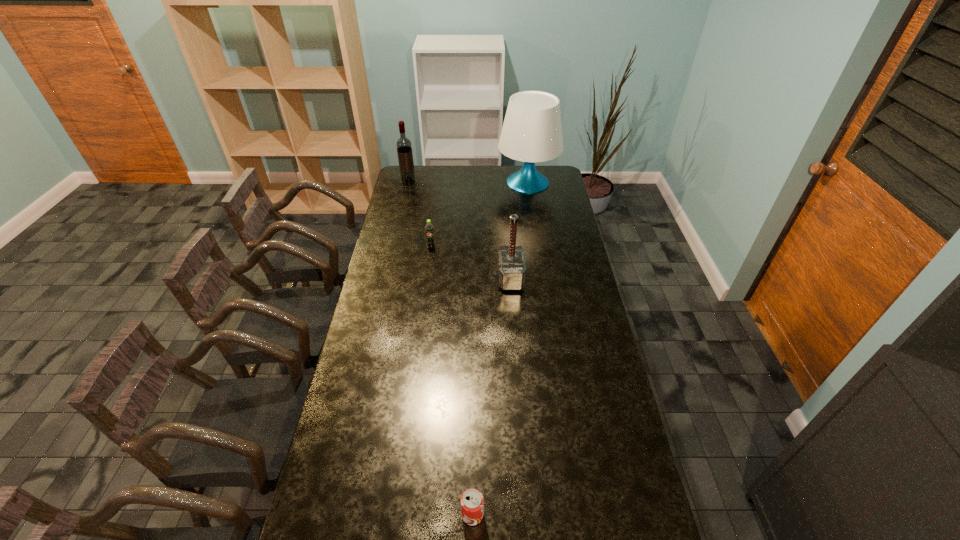
Locate an element on the screen. The image size is (960, 540). free space at the left edge is located at coordinates (361, 371).

Locate an element on the screen. vacant space at the right edge of the desktop is located at coordinates 587,354.

In the image, there is a desktop. In order to click on blank space at the far left corner in this screenshot , I will do `click(415, 181)`.

Find the location of a particular element. The height and width of the screenshot is (540, 960). unoccupied area between the taller soda can and the leftmost object is located at coordinates (420, 214).

Find the location of a particular element. The height and width of the screenshot is (540, 960). blank region between the fourth object from right to left and the tallest object is located at coordinates (479, 215).

Locate an element on the screen. This screenshot has height=540, width=960. empty space between the nearest object and the fourth farthest object is located at coordinates (492, 396).

Find the location of a particular element. The width and height of the screenshot is (960, 540). vacant area between the taller soda can and the wine bottle is located at coordinates (420, 214).

At what (x,y) coordinates should I click in order to perform the action: click on vacant space in between the third nearest object and the tallest object. Please return your answer as a coordinate pair (x, y). Looking at the image, I should click on (479, 215).

At what (x,y) coordinates should I click in order to perform the action: click on free spot between the nearer soda can and the taller soda can. Please return your answer as a coordinate pair (x, y). Looking at the image, I should click on (452, 381).

At what (x,y) coordinates should I click in order to perform the action: click on unoccupied position between the leftmost object and the third object from right to left. Please return your answer as a coordinate pair (x, y). This screenshot has height=540, width=960. Looking at the image, I should click on click(x=441, y=348).